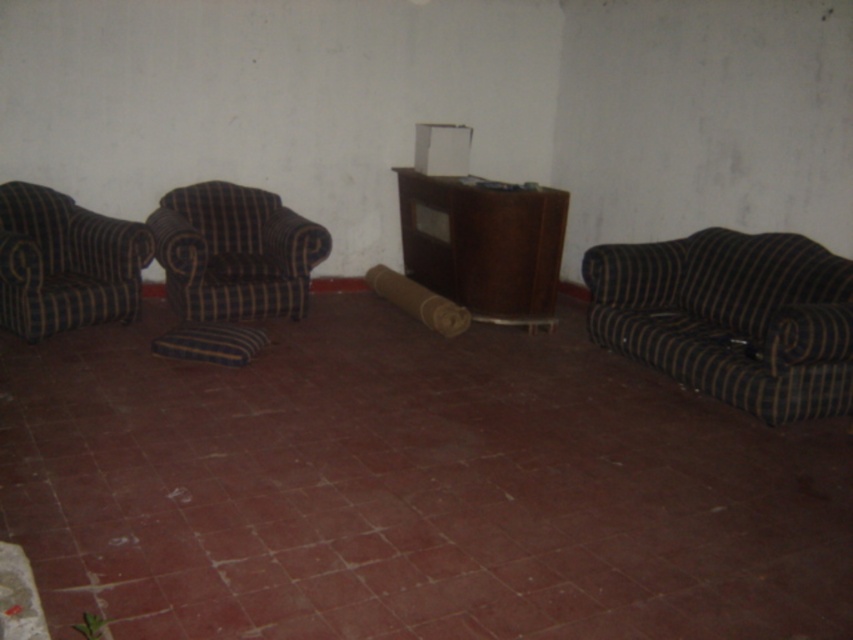
Question: Considering the relative positions of striped fabric couch at right and blue striped pillow at lower right in the image provided, where is striped fabric couch at right located with respect to blue striped pillow at lower right?

Choices:
 (A) right
 (B) left

Answer: (B)

Question: Among these objects, which one is farthest from the camera?

Choices:
 (A) blue striped pillow at lower right
 (B) striped fabric couch at right

Answer: (B)

Question: Is striped fabric couch at right above blue striped pillow at lower right?

Choices:
 (A) no
 (B) yes

Answer: (B)

Question: Estimate the real-world distances between objects in this image. Which object is farther from the blue striped pillow at lower right?

Choices:
 (A) striped fabric armchair at left
 (B) brown wooden cabinet at center
 (C) brown striped armchair at left

Answer: (A)

Question: Which object is farther from the camera taking this photo?

Choices:
 (A) brown wooden cabinet at center
 (B) blue striped pillow at lower right
 (C) brown striped armchair at left

Answer: (A)

Question: From the image, what is the correct spatial relationship of striped fabric couch at right in relation to blue striped pillow at lower right?

Choices:
 (A) left
 (B) right

Answer: (A)